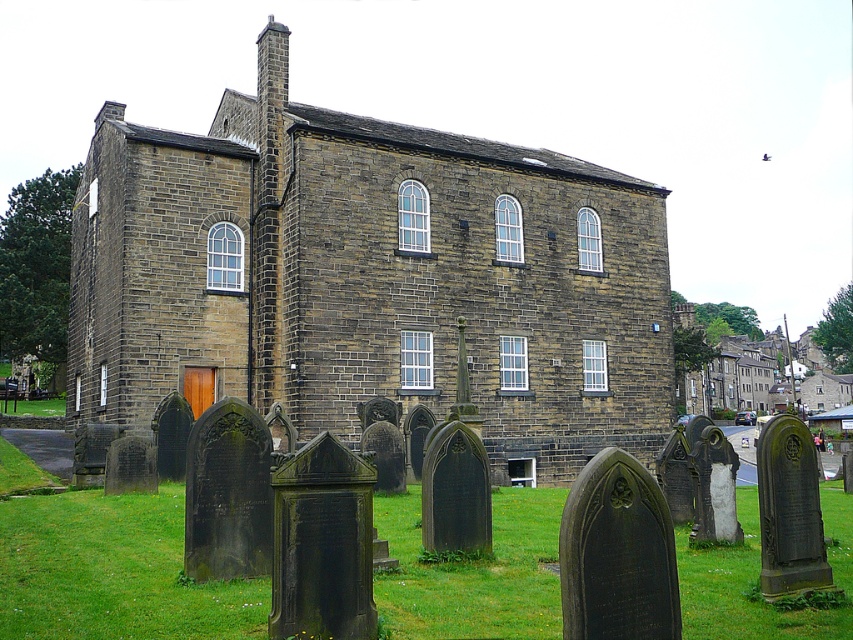
Question: Among these objects, which one is farthest from the camera?

Choices:
 (A) green grass at lower center
 (B) brown stone church at center

Answer: (B)

Question: Does brown stone church at center appear on the right side of green grass at lower center?

Choices:
 (A) no
 (B) yes

Answer: (A)

Question: Among these objects, which one is farthest from the camera?

Choices:
 (A) brown stone church at center
 (B) green grass at lower center

Answer: (A)

Question: Is brown stone church at center to the right of green grass at lower center from the viewer's perspective?

Choices:
 (A) no
 (B) yes

Answer: (A)

Question: Which object is farther from the camera taking this photo?

Choices:
 (A) green grass at lower center
 (B) brown stone church at center

Answer: (B)

Question: Is brown stone church at center further to camera compared to green grass at lower center?

Choices:
 (A) yes
 (B) no

Answer: (A)